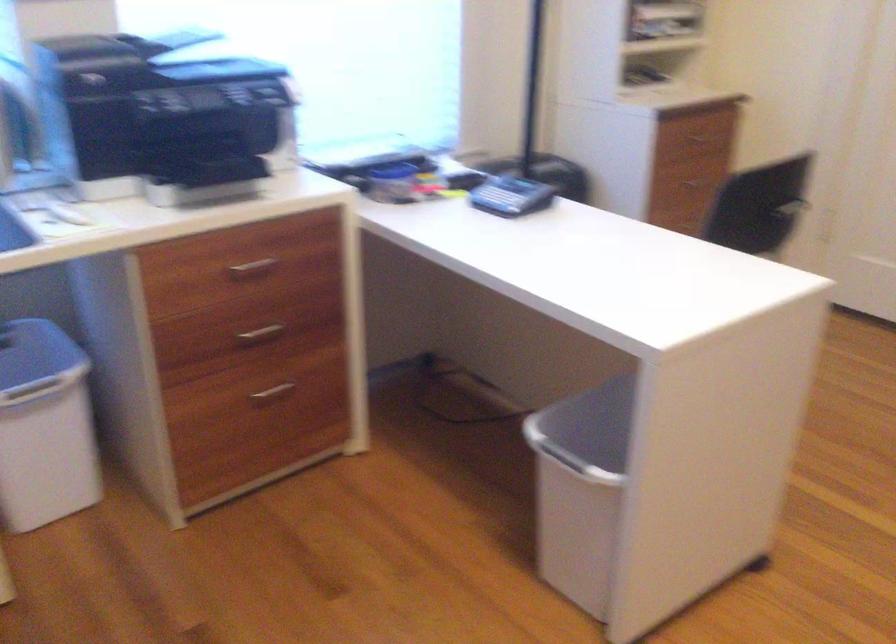
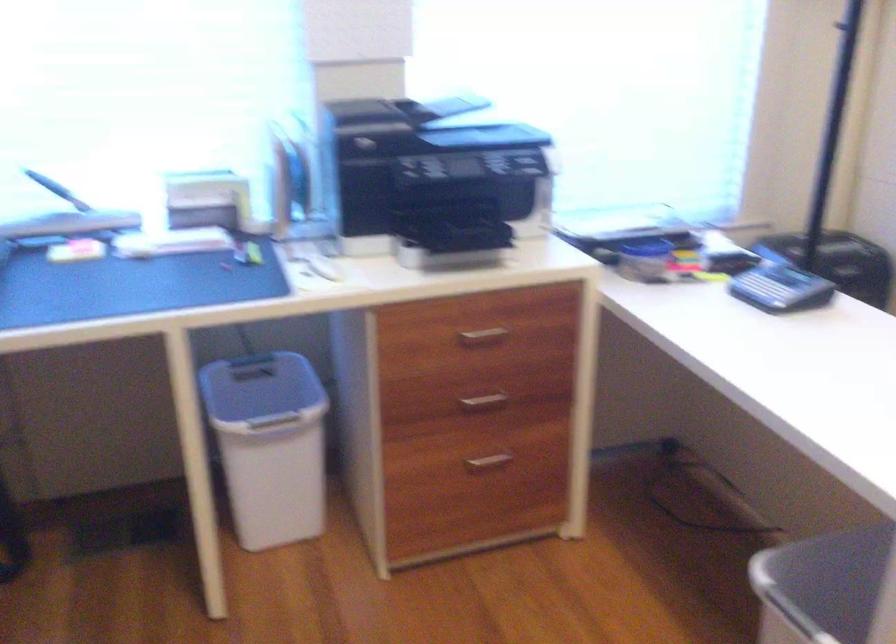
Locate, in the second image, the point that corresponds to (513,194) in the first image.

(780, 288)